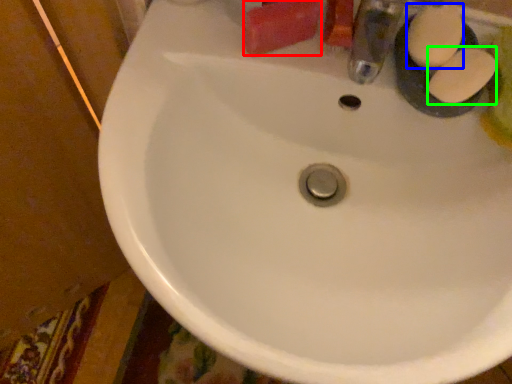
Question: Based on their relative distances, which object is farther from soap (highlighted by a red box)? Choose from soap (highlighted by a blue box) and soap (highlighted by a green box).

Choices:
 (A) soap
 (B) soap

Answer: (B)